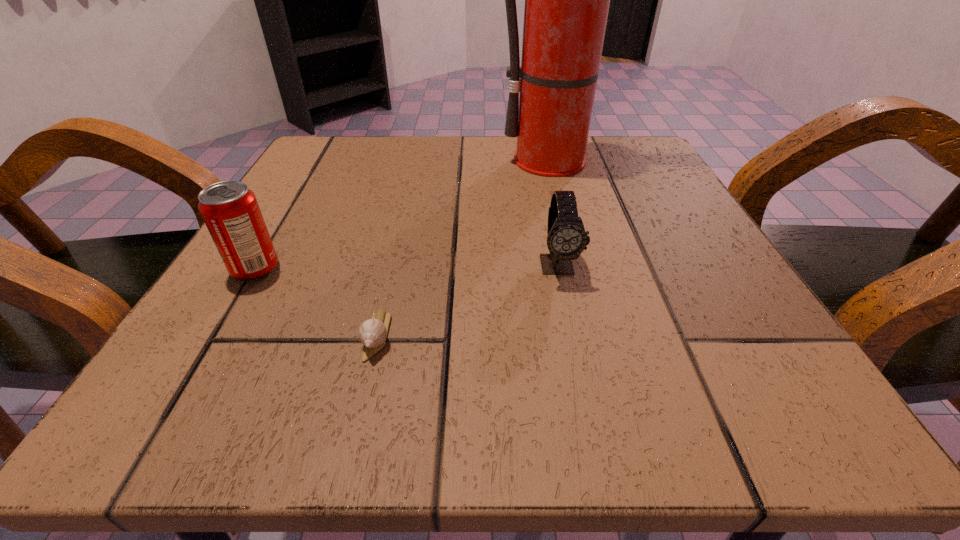
Identify the location of the farthest object. This screenshot has height=540, width=960. (567, 0).

I want to click on fire extinguisher, so [x=567, y=0].

This screenshot has height=540, width=960. In order to click on the leftmost object in this screenshot , I will do `click(230, 210)`.

This screenshot has width=960, height=540. I want to click on watch, so click(566, 238).

Locate an element on the screen. The height and width of the screenshot is (540, 960). escargot is located at coordinates (372, 333).

The image size is (960, 540). In order to click on the third object from right to left in this screenshot , I will do `click(372, 333)`.

Image resolution: width=960 pixels, height=540 pixels. Find the location of `vacant space situated 0.380m with the handle and hose on the tallest object`. vacant space situated 0.380m with the handle and hose on the tallest object is located at coordinates (609, 321).

Where is `blank area located 0.080m on the back of the soda can`? This screenshot has width=960, height=540. blank area located 0.080m on the back of the soda can is located at coordinates (281, 225).

Where is `vacant area situated 0.150m on the face of the watch`? This screenshot has width=960, height=540. vacant area situated 0.150m on the face of the watch is located at coordinates (581, 374).

Find the location of a particular element. The height and width of the screenshot is (540, 960). object situated at the far edge is located at coordinates (567, 0).